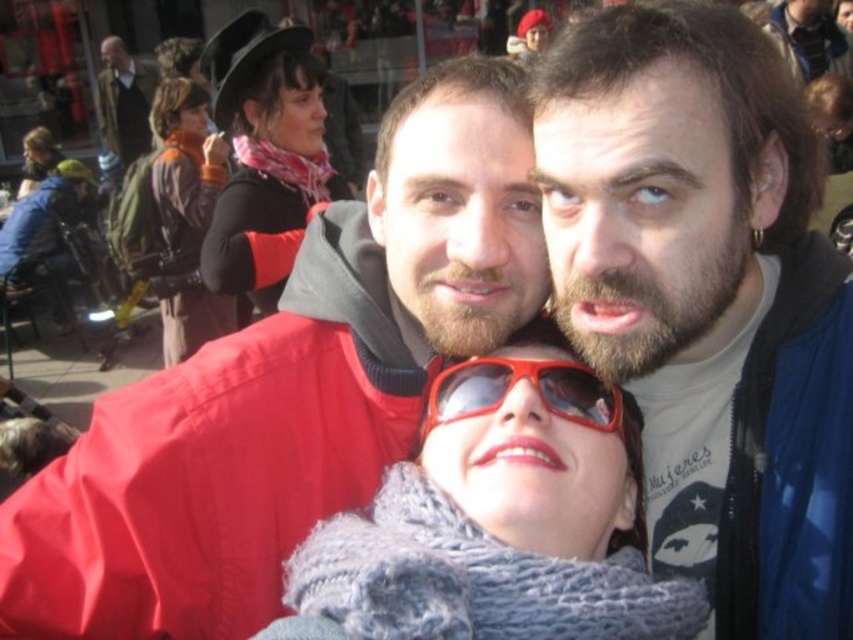
Can you confirm if knitted gray scarf at center is shorter than matte pink scarf at upper left?

Yes.

Is point (505, 529) less distant than point (33, 186)?

Yes, it is in front of point (33, 186).

Image resolution: width=853 pixels, height=640 pixels. Identify the location of knitted gray scarf at center. (498, 522).

Can you confirm if matte black hat at upper left is wider than matte pink scarf at upper left?

Yes, matte black hat at upper left is wider than matte pink scarf at upper left.

Is matte black hat at upper left positioned at the back of matte pink scarf at upper left?

No.

Describe the element at coordinates (265, 154) in the screenshot. I see `matte black hat at upper left` at that location.

Identify the location of matte black hat at upper left. (265, 154).

Who is shorter, orange fabric scarf at upper left or red plastic sunglasses at center?

With less height is red plastic sunglasses at center.

Can you confirm if orange fabric scarf at upper left is thinner than red plastic sunglasses at center?

Incorrect, orange fabric scarf at upper left's width is not less than red plastic sunglasses at center's.

Measure the distance between orange fabric scarf at upper left and camera.

A distance of 5.34 meters exists between orange fabric scarf at upper left and camera.

The width and height of the screenshot is (853, 640). I want to click on orange fabric scarf at upper left, so click(x=187, y=218).